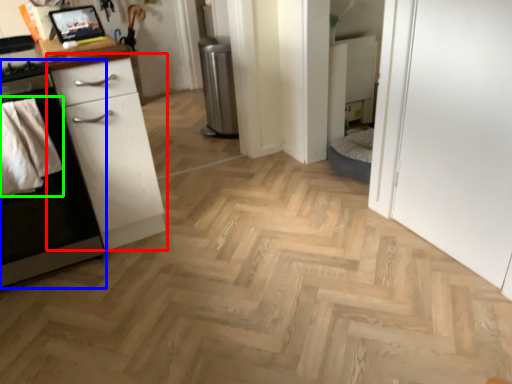
Question: Which object is the farthest from chest of drawers (highlighted by a red box)? Choose among these: cabinetry (highlighted by a blue box) or material (highlighted by a green box).

Choices:
 (A) cabinetry
 (B) material

Answer: (B)